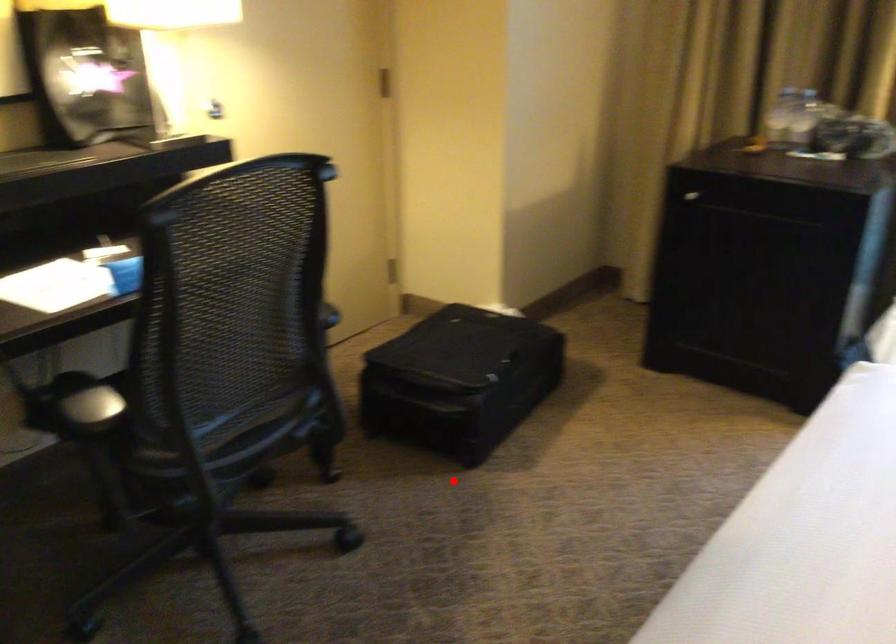
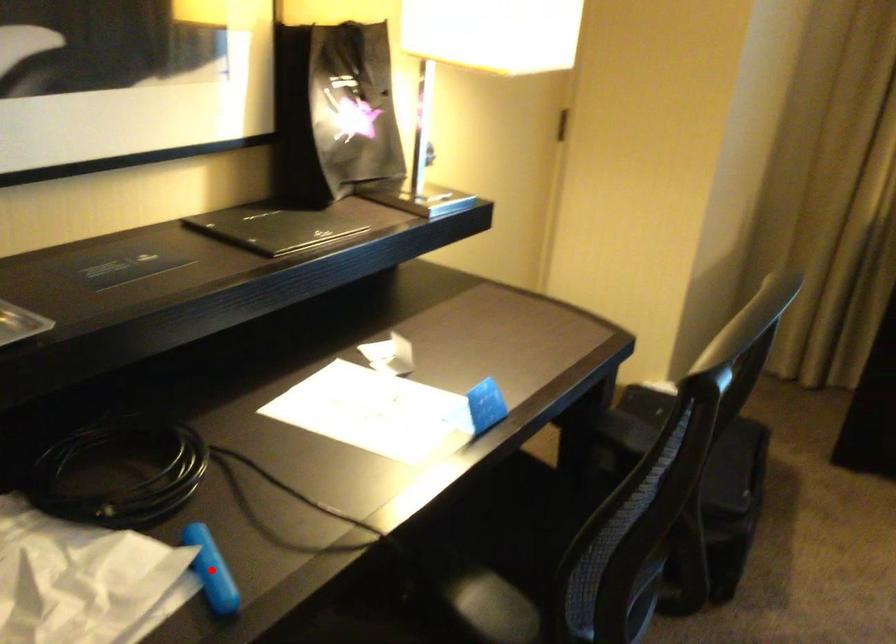
I am providing you with two images of the same scene from different viewpoints. A red point is marked on the first image and another point is marked on the second image. Is the marked point in image1 the same physical position as the marked point in image2?

No